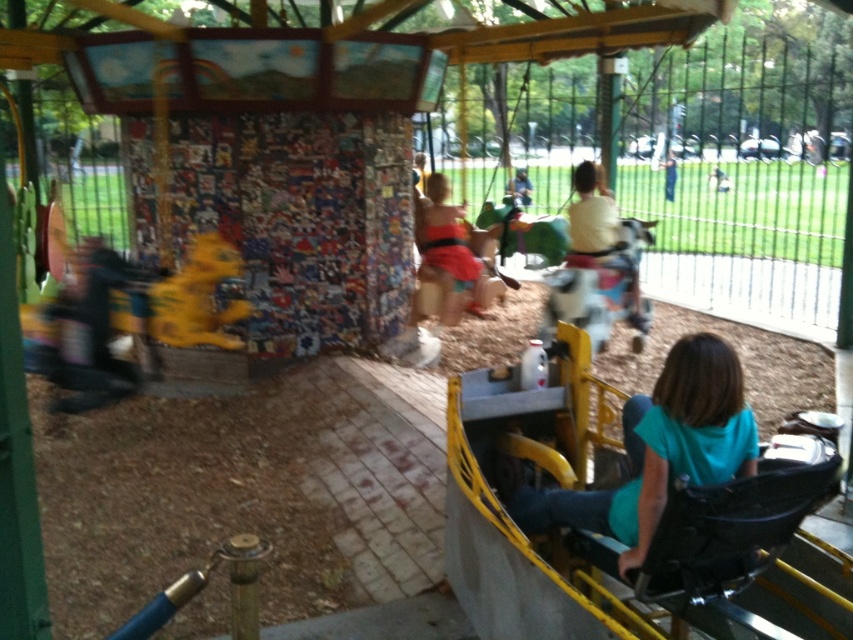
You are standing in front of the carousel and see two points marked on the carousel structure. Which point, point [570,204] or point [674,180], is closer to you?

Point [570,204] is closer to you than point [674,180].

You are a parent standing at the edge of the carousel area. You see your child sitting on the matte yellow swing at center and the matte yellow plush at center. You want to place a small gift between them. Is there enough space to place the gift between them?

The matte yellow swing at center and matte yellow plush at center are 5.13 meters apart from each other, so yes, there is enough space to place the gift between them since the distance is sufficient.

You are a photographer trying to capture a clear photo of the child on the carousel. Since the white cotton shirt at center and dark blue jeans at center are both in the frame, which part of the child should you focus on to ensure the photo isn not blurry?

You should focus on the dark blue jeans at center because it occupies more space and will be easier to capture clearly in the photo.